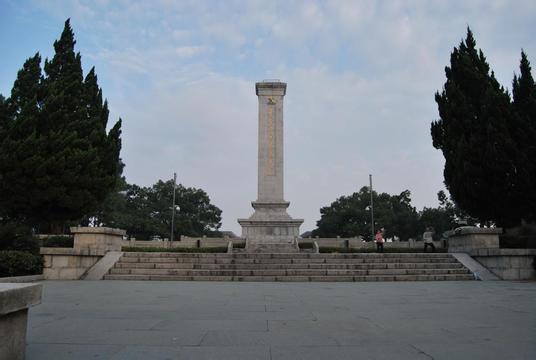
You are a GUI agent. You are given a task and a screenshot of the screen. Output one action in this format:
    pyautogui.click(x=<x>, y=<y>)
    Task: Click on the stairs
    
    Given the screenshot: What is the action you would take?
    pyautogui.click(x=411, y=264)